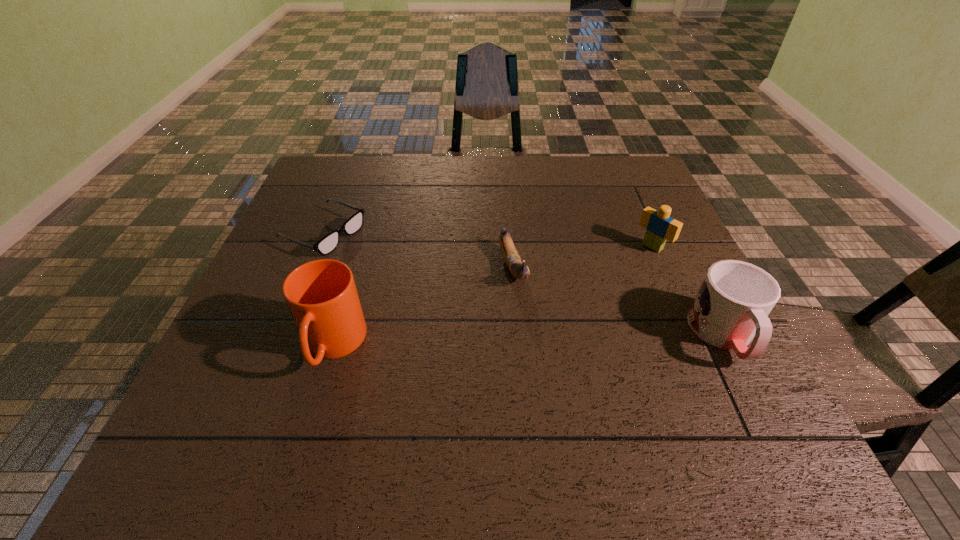
Identify the location of empty space between the Lego and the shortest object. (488, 240).

At what (x,y) coordinates should I click in order to perform the action: click on free point between the left mug and the shorter mug. Please return your answer as a coordinate pair (x, y). Image resolution: width=960 pixels, height=540 pixels. Looking at the image, I should click on point(529,340).

Find the location of a particular element. free space between the third object from left to right and the shorter mug is located at coordinates (618, 301).

The width and height of the screenshot is (960, 540). Find the location of `vacant space that's between the right mug and the spectacles`. vacant space that's between the right mug and the spectacles is located at coordinates (524, 284).

Locate an element on the screen. vacant area that lies between the Lego and the left mug is located at coordinates [x=492, y=296].

The height and width of the screenshot is (540, 960). What are the coordinates of `free space between the spectacles and the Lego` in the screenshot? It's located at (488, 240).

Locate an element on the screen. free space between the second shortest object and the tallest object is located at coordinates (423, 306).

Select which object appears as the closest to the Lego. Please provide its 2D coordinates. Your answer should be formatted as a tuple, i.e. [(x, y)], where the tuple contains the x and y coordinates of a point satisfying the conditions above.

[(731, 308)]

Find the location of `object that is the third closest one to the shorter mug`. object that is the third closest one to the shorter mug is located at coordinates (322, 297).